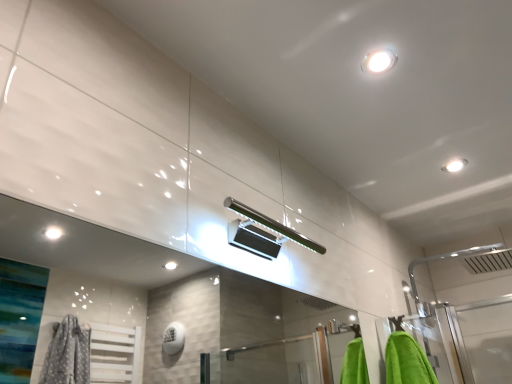
Question: Should I look upward or downward to see white glossy droplight at upper right?

Choices:
 (A) down
 (B) up

Answer: (B)